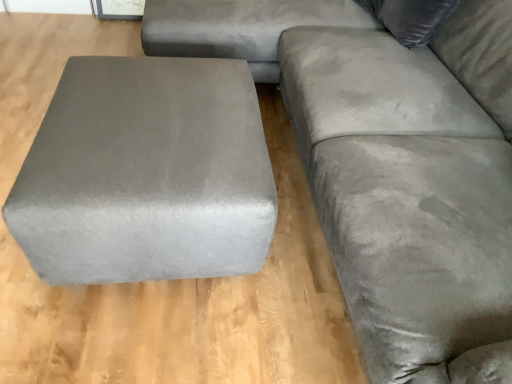
Question: Can you confirm if velvet gray pillow at upper right is positioned to the left of satin gray ottoman at left?

Choices:
 (A) yes
 (B) no

Answer: (B)

Question: Does velvet gray pillow at upper right have a smaller size compared to satin gray ottoman at left?

Choices:
 (A) yes
 (B) no

Answer: (A)

Question: From a real-world perspective, is velvet gray pillow at upper right beneath satin gray ottoman at left?

Choices:
 (A) no
 (B) yes

Answer: (A)

Question: From a real-world perspective, does velvet gray pillow at upper right stand above satin gray ottoman at left?

Choices:
 (A) no
 (B) yes

Answer: (B)

Question: Considering the relative sizes of velvet gray pillow at upper right and satin gray ottoman at left in the image provided, is velvet gray pillow at upper right wider than satin gray ottoman at left?

Choices:
 (A) yes
 (B) no

Answer: (B)

Question: Is velvet gray pillow at upper right inside or outside of satin gray ottoman at left?

Choices:
 (A) outside
 (B) inside

Answer: (A)

Question: Does point (412, 21) appear closer or farther from the camera than point (244, 215)?

Choices:
 (A) closer
 (B) farther

Answer: (B)

Question: Considering the positions of velvet gray pillow at upper right and satin gray ottoman at left in the image, is velvet gray pillow at upper right taller or shorter than satin gray ottoman at left?

Choices:
 (A) tall
 (B) short

Answer: (B)

Question: Considering the positions of velvet gray pillow at upper right and satin gray ottoman at left in the image, is velvet gray pillow at upper right wider or thinner than satin gray ottoman at left?

Choices:
 (A) thin
 (B) wide

Answer: (A)

Question: Considering the relative positions of velvet gray pillow at upper right and suede gray couch at right in the image provided, is velvet gray pillow at upper right to the left or to the right of suede gray couch at right?

Choices:
 (A) right
 (B) left

Answer: (B)

Question: In terms of width, does velvet gray pillow at upper right look wider or thinner when compared to suede gray couch at right?

Choices:
 (A) thin
 (B) wide

Answer: (A)

Question: Is velvet gray pillow at upper right bigger or smaller than suede gray couch at right?

Choices:
 (A) big
 (B) small

Answer: (B)

Question: From the image's perspective, is velvet gray pillow at upper right located above or below suede gray couch at right?

Choices:
 (A) above
 (B) below

Answer: (A)

Question: Considering the positions of satin gray ottoman at left and suede gray couch at right in the image, is satin gray ottoman at left taller or shorter than suede gray couch at right?

Choices:
 (A) tall
 (B) short

Answer: (B)

Question: In the image, is satin gray ottoman at left on the left side or the right side of suede gray couch at right?

Choices:
 (A) left
 (B) right

Answer: (A)